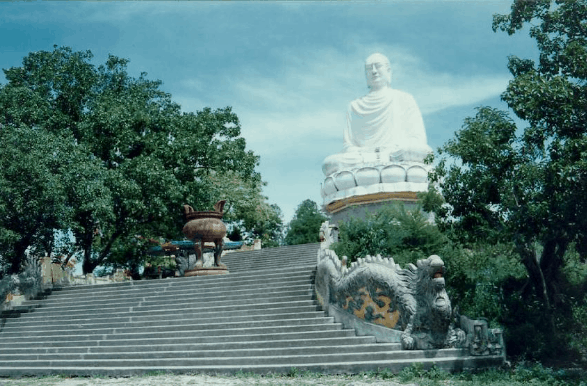
Identify the location of statue. The height and width of the screenshot is (386, 587). click(x=377, y=93).